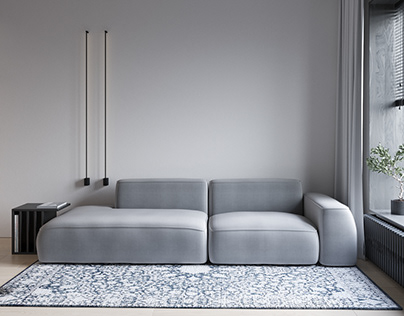
You are a GUI agent. You are given a task and a screenshot of the screen. Output one action in this format:
    pyautogui.click(x=<x>, y=<y>)
    Task: Click on the seat cushions
    This screenshot has height=316, width=404.
    Given the screenshot: What is the action you would take?
    pyautogui.click(x=125, y=217), pyautogui.click(x=260, y=222)